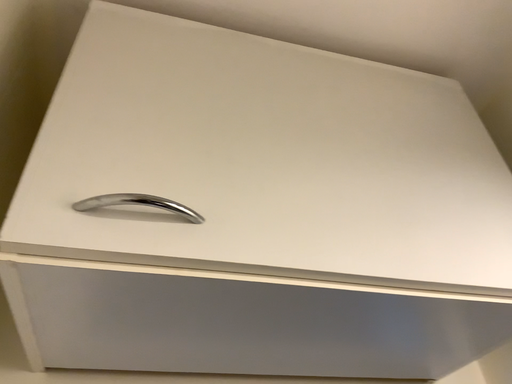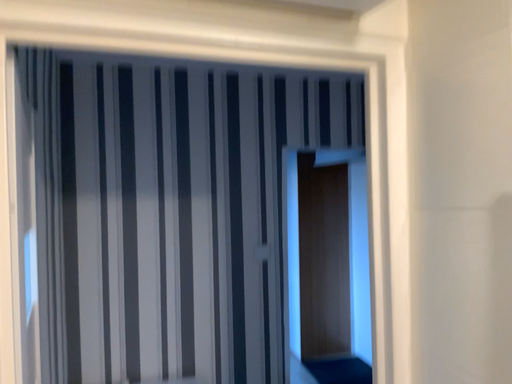
Question: How did the camera likely rotate when shooting the video?

Choices:
 (A) rotated upward
 (B) rotated downward

Answer: (B)